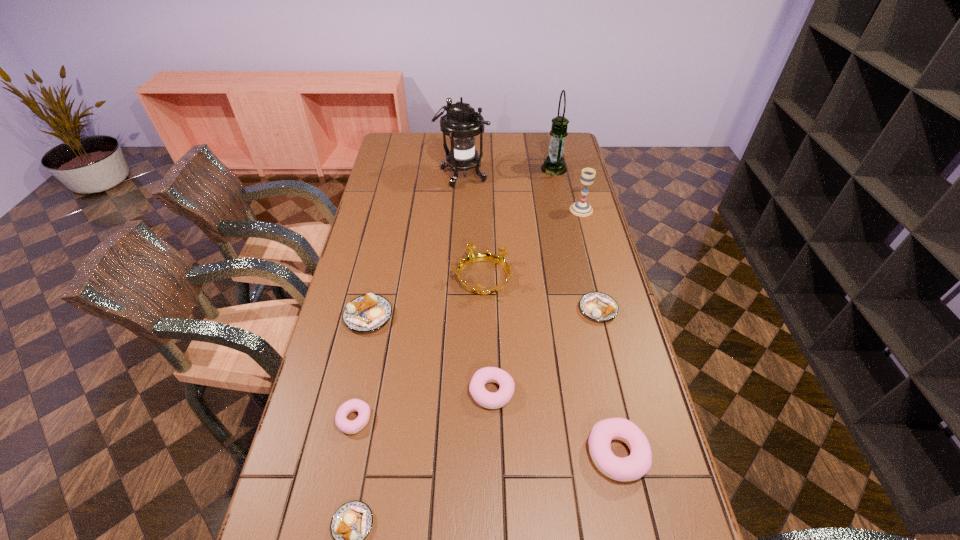
Image resolution: width=960 pixels, height=540 pixels. What are the coordinates of `pastry that can be found as the fifth closest to the green lantern` in the screenshot? It's located at (349, 427).

Find the location of a particular element. the second closest pink pastry to the chalice is located at coordinates (638, 463).

Find the location of `the closest pink pastry to the second pink pastry from left to right`. the closest pink pastry to the second pink pastry from left to right is located at coordinates (638, 463).

Identify which brown pastry is located as the second nearest to the rightmost pink pastry. Please provide its 2D coordinates. Your answer should be formatted as a tuple, i.e. [(x, y)], where the tuple contains the x and y coordinates of a point satisfying the conditions above.

[(351, 523)]

Identify which brown pastry is the nearest to the second biggest brown pastry. Please provide its 2D coordinates. Your answer should be formatted as a tuple, i.e. [(x, y)], where the tuple contains the x and y coordinates of a point satisfying the conditions above.

[(366, 313)]

Identify the location of vacant space that satisfies the following two spatial constraints: 1. on the side where the rightmost brown pastry emits light; 2. on the left side of the green lantern. (584, 309).

This screenshot has height=540, width=960. Identify the location of free space that satisfies the following two spatial constraints: 1. on the back side of the gray chalice; 2. on the right side of the rightmost pink pastry. (564, 210).

This screenshot has height=540, width=960. Identify the location of free spot that satisfies the following two spatial constraints: 1. on the side where the right lantern emits light; 2. on the left side of the third tallest object. (563, 210).